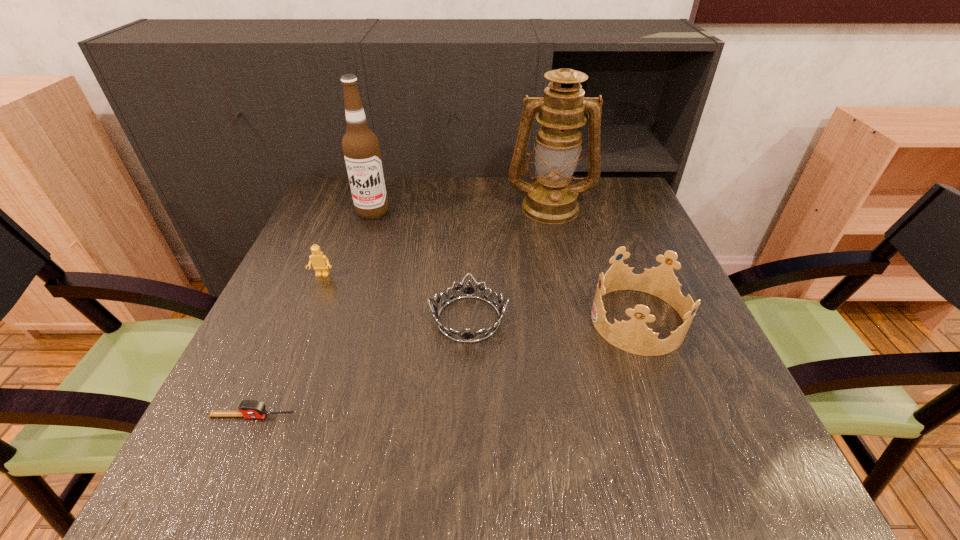
Identify the location of free space at the right edge. The width and height of the screenshot is (960, 540). (669, 410).

Where is `vacant space at the near left corner of the desktop`? vacant space at the near left corner of the desktop is located at coordinates (218, 478).

I want to click on empty space that is in between the taller tiara and the alcohol, so click(x=506, y=266).

Where is `free area in between the third shortest object and the left tiara`? This screenshot has width=960, height=540. free area in between the third shortest object and the left tiara is located at coordinates (396, 297).

Where is `vacant space that is in between the alcohol and the taller tiara`? vacant space that is in between the alcohol and the taller tiara is located at coordinates (506, 266).

Find the location of a particular element. The image size is (960, 540). free space between the third shortest object and the tape measure is located at coordinates (287, 346).

Identify the location of free space between the alcohol and the third tallest object. (506, 266).

The image size is (960, 540). What are the coordinates of `free space between the fifth tallest object and the third tallest object` in the screenshot? It's located at click(x=554, y=320).

Where is `vacant area that lies between the Lego and the alcohol`? vacant area that lies between the Lego and the alcohol is located at coordinates [x=348, y=244].

Where is `unoccupied position between the shorter tiara and the oil lamp`? This screenshot has height=540, width=960. unoccupied position between the shorter tiara and the oil lamp is located at coordinates (510, 263).